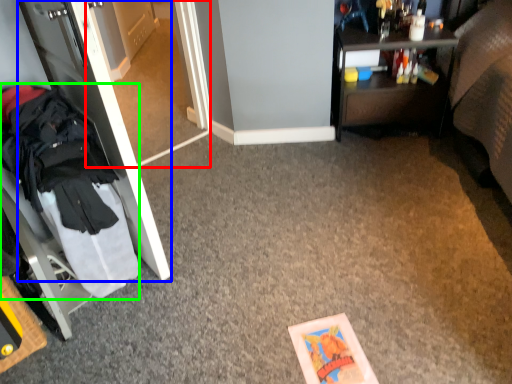
Question: Based on their relative distances, which object is farther from glass door (highlighted by a red box)? Choose from door (highlighted by a blue box) and clothing (highlighted by a green box).

Choices:
 (A) door
 (B) clothing

Answer: (B)